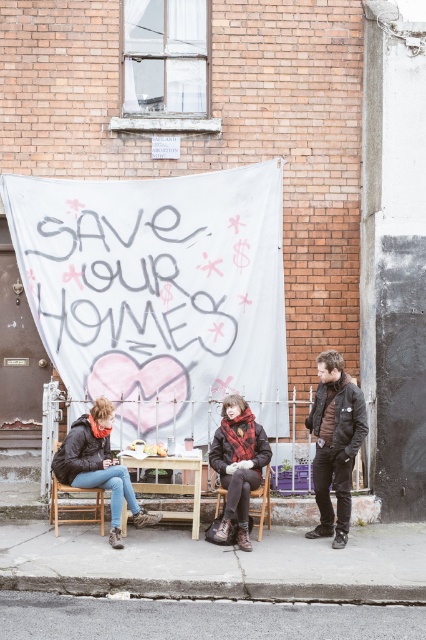
Question: Can you confirm if leather jacket at center is positioned to the right of wooden chair at center?

Choices:
 (A) yes
 (B) no

Answer: (B)

Question: Estimate the real-world distances between objects in this image. Which object is farther from the wooden chair at lower left?

Choices:
 (A) leather jacket at center
 (B) wooden chair at center

Answer: (B)

Question: Can you confirm if wooden table at center is smaller than wooden chair at center?

Choices:
 (A) no
 (B) yes

Answer: (A)

Question: From the image, what is the correct spatial relationship of leather jacket at center in relation to wooden chair at lower left?

Choices:
 (A) left
 (B) right

Answer: (B)

Question: Based on their relative distances, which object is nearer to the wooden table at center?

Choices:
 (A) matte black jacket at lower left
 (B) leather jacket at center
 (C) leather jacket at right
 (D) wooden chair at lower left

Answer: (B)

Question: Which point is closer to the camera?

Choices:
 (A) matte black jacket at lower left
 (B) leather jacket at center
 (C) wooden chair at lower left

Answer: (B)